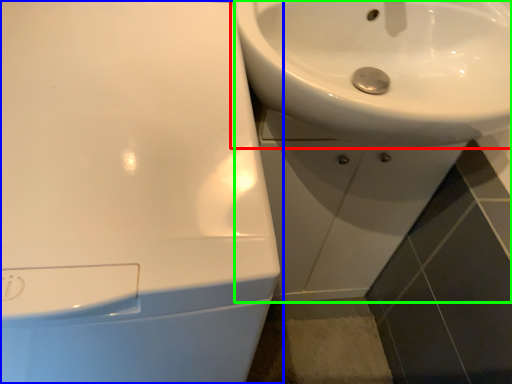
Question: Which object is positioned farthest from sink (highlighted by a red box)? Select from sink (highlighted by a blue box) and sink (highlighted by a green box).

Choices:
 (A) sink
 (B) sink

Answer: (A)